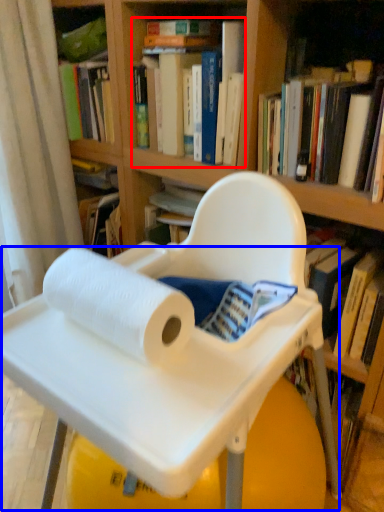
Question: Among these objects, which one is farthest to the camera, book (highlighted by a red box) or table (highlighted by a blue box)?

Choices:
 (A) book
 (B) table

Answer: (A)